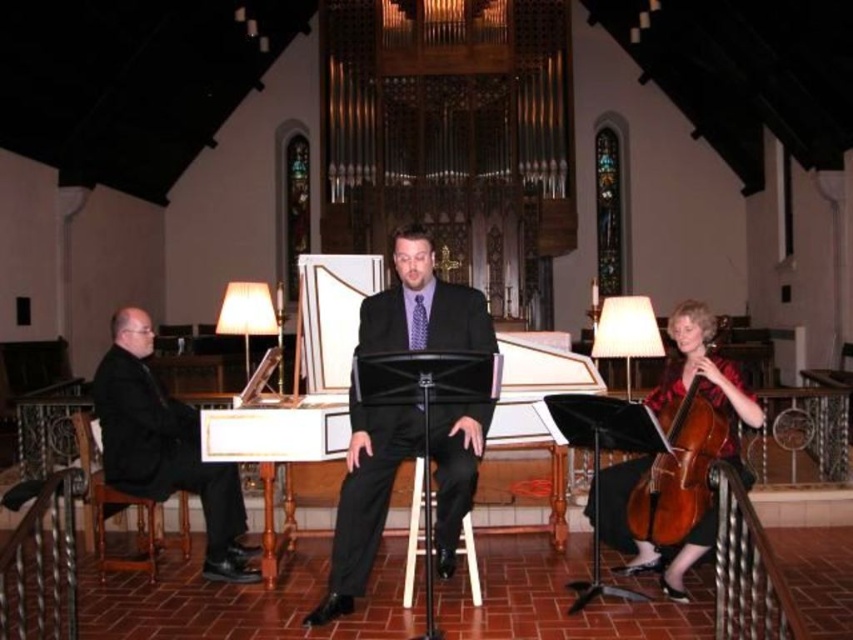
Question: Which point is closer to the camera taking this photo?

Choices:
 (A) (154, 518)
 (B) (422, 301)

Answer: (B)

Question: Is brown wooden cello at lower right positioned at the back of brown wooden chair at left?

Choices:
 (A) yes
 (B) no

Answer: (B)

Question: Is brown wooden cello at lower right below wooden stool at center?

Choices:
 (A) no
 (B) yes

Answer: (A)

Question: Considering the real-world distances, which object is closest to the brown wooden chair at left?

Choices:
 (A) matte black suit at center
 (B) wooden stool at center
 (C) brown wooden cello at lower right

Answer: (A)

Question: Among these points, which one is nearest to the camera?

Choices:
 (A) coord(409,582)
 (B) coord(152,532)
 (C) coord(718,404)
 (D) coord(397,268)

Answer: (D)

Question: Does brown wooden cello at lower right have a greater width compared to wooden stool at center?

Choices:
 (A) yes
 (B) no

Answer: (A)